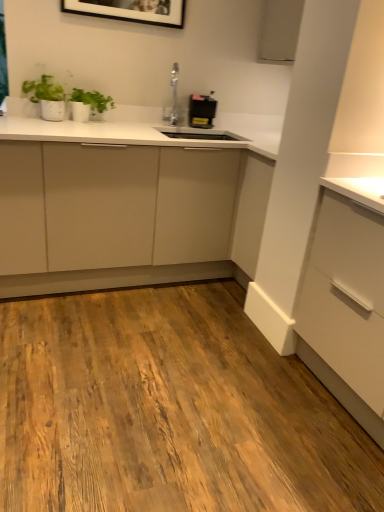
In order to face matte white dresser at center, should I rotate leftwards or rightwards?

You should rotate right by 2.021 degrees.

Find the location of a particular element. Image resolution: width=384 pixels, height=512 pixels. matte white cabinet at center is located at coordinates (129, 204).

What do you see at coordinates (201, 111) in the screenshot? I see `black plastic toaster at upper center` at bounding box center [201, 111].

Locate an element on the screen. matte white dresser at center is located at coordinates (150, 254).

Measure the distance from black plastic toaster at upper center to matte white dresser at center.

black plastic toaster at upper center and matte white dresser at center are 32.05 inches apart from each other.

Considering the relative positions of black plastic toaster at upper center and matte white dresser at center in the image provided, is black plastic toaster at upper center to the left of matte white dresser at center from the viewer's perspective?

Incorrect, black plastic toaster at upper center is not on the left side of matte white dresser at center.

Does point (191, 103) lie behind point (31, 160)?

Yes.

From a real-world perspective, is black plastic toaster at upper center above or below matte white dresser at center?

Clearly, from a real-world perspective, black plastic toaster at upper center is above matte white dresser at center.

From the image's perspective, which one is positioned higher, matte white cabinet at center or green matte plant at upper left?

green matte plant at upper left, from the image's perspective.

Does matte white cabinet at center contain green matte plant at upper left?

Yes.

The height and width of the screenshot is (512, 384). Find the location of `plant that appears on the left of matte white cabinet at center`. plant that appears on the left of matte white cabinet at center is located at coordinates (92, 100).

Is matte white cabinet at center oriented away from green matte plant at upper left?

No, green matte plant at upper left is not at the back of matte white cabinet at center.

Between point (321, 365) and point (75, 89), which one is positioned behind?

The point (75, 89) is farther from the camera.

Does matte white dresser at center have a lesser width compared to green matte plant at upper left?

No.

Is matte white dresser at center positioned in front of green matte plant at upper left?

Yes, matte white dresser at center is closer to the viewer.

Is matte white dresser at center placed right next to green matte plant at upper left?

No, matte white dresser at center is not next to green matte plant at upper left.

Is matte white cabinet at center oriented away from matte white dresser at center?

Correct, matte white cabinet at center is looking away from matte white dresser at center.

Does point (84, 277) come in front of point (243, 150)?

No, (84, 277) is behind (243, 150).

Relative to matte white dresser at center, is matte white cabinet at center in front or behind?

Visually, matte white cabinet at center is located behind matte white dresser at center.

Considering the relative sizes of matte white cabinet at center and matte white dresser at center in the image provided, is matte white cabinet at center wider than matte white dresser at center?

No.

From the image's perspective, is matte white dresser at center under black plastic toaster at upper center?

Yes.

Does point (261, 177) come in front of point (188, 120)?

Yes, point (261, 177) is in front of point (188, 120).

Is matte white dresser at center not within black plastic toaster at upper center?

A: matte white dresser at center is positioned outside black plastic toaster at upper center.

Considering the sizes of objects matte white dresser at center and black plastic toaster at upper center in the image provided, who is bigger, matte white dresser at center or black plastic toaster at upper center?

matte white dresser at center.

How many degrees apart are the facing directions of green matte plant at upper left and matte white dresser at center?

green matte plant at upper left and matte white dresser at center are facing 0.549 degrees away from each other.

Is matte white dresser at center completely or partially inside green matte plant at upper left?

No.

Would you say green matte plant at upper left is to the left or to the right of matte white dresser at center in the picture?

green matte plant at upper left is positioned on matte white dresser at center's left side.

Does green matte plant at upper left have a lesser height compared to matte white dresser at center?

Yes, green matte plant at upper left is shorter than matte white dresser at center.

Between point (207, 104) and point (79, 89), which one is positioned in front?

The point (79, 89) is closer to the camera.

Considering the sizes of objects black plastic toaster at upper center and green matte plant at upper left in the image provided, who is taller, black plastic toaster at upper center or green matte plant at upper left?

With more height is black plastic toaster at upper center.

Is black plastic toaster at upper center far from green matte plant at upper left?

They are positioned close to each other.

Is black plastic toaster at upper center positioned before green matte plant at upper left?

No, black plastic toaster at upper center is further to the viewer.

The width and height of the screenshot is (384, 512). Identify the location of appliance above the matte white dresser at center (from the image's perspective). (201, 111).

The height and width of the screenshot is (512, 384). Identify the location of plant located above the matte white cabinet at center (from a real-world perspective). (92, 100).

Which object lies further to the anchor point matte white dresser at center, green matte plant at upper left or matte white cabinet at center?

Among the two, green matte plant at upper left is located further to matte white dresser at center.

Based on their spatial positions, is matte white cabinet at center or matte white dresser at center further from black plastic toaster at upper center?

matte white cabinet at center.

Based on their spatial positions, is black plastic toaster at upper center or matte white dresser at center closer to green matte plant at upper left?

Among the two, black plastic toaster at upper center is located nearer to green matte plant at upper left.

Looking at the image, which one is located closer to green matte plant at upper left, matte white dresser at center or black plastic toaster at upper center?

Based on the image, black plastic toaster at upper center appears to be nearer to green matte plant at upper left.

From the image, which object appears to be farther from matte white dresser at center, black plastic toaster at upper center or green matte plant at upper left?

black plastic toaster at upper center is further to matte white dresser at center.

From the image, which object appears to be nearer to black plastic toaster at upper center, matte white dresser at center or matte white cabinet at center?

Based on the image, matte white dresser at center appears to be nearer to black plastic toaster at upper center.

From the image, which object appears to be farther from matte white cabinet at center, green matte plant at upper left or black plastic toaster at upper center?

green matte plant at upper left is further to matte white cabinet at center.

When comparing their distances from green matte plant at upper left, does matte white cabinet at center or matte white dresser at center seem closer?

The object closer to green matte plant at upper left is matte white dresser at center.

At what (x,y) coordinates should I click in order to perform the action: click on plant located between matte white cabinet at center and black plastic toaster at upper center in the depth direction. Please return your answer as a coordinate pair (x, y). Looking at the image, I should click on (92, 100).

The width and height of the screenshot is (384, 512). Identify the location of cabinetry between matte white dresser at center and green matte plant at upper left along the z-axis. (129, 204).

Where is `cabinetry between matte white dresser at center and black plastic toaster at upper center along the z-axis`? This screenshot has width=384, height=512. cabinetry between matte white dresser at center and black plastic toaster at upper center along the z-axis is located at coordinates (129, 204).

Where is `plant between matte white dresser at center and black plastic toaster at upper center from front to back`? plant between matte white dresser at center and black plastic toaster at upper center from front to back is located at coordinates (92, 100).